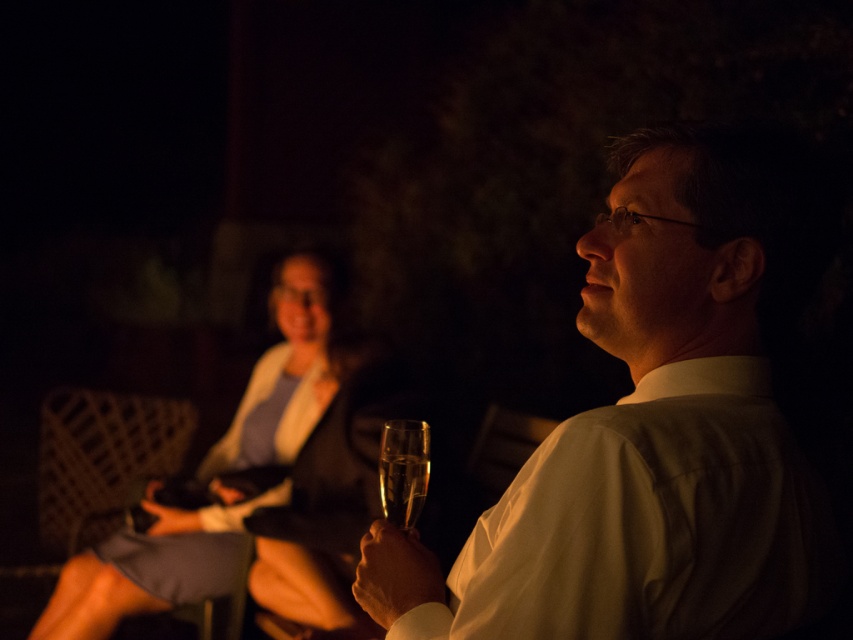
Looking at this image, you are organizing a photo shoot and need to ensure that the matte white shirt at center and the matte black dress at center are both visible in the frame. Based on their sizes, which clothing item might require more careful positioning to avoid being overwhelmed by the other?

The matte white shirt at center occupies less space than the matte black dress at center, so the matte white shirt at center might require more careful positioning to avoid being overwhelmed by the larger matte black dress at center.

Consider the image. You are a photographer adjusting your camera settings to capture the scene. You notice the matte white shirt at center and the matte black dress at center. Which one is closer to the camera?

Result: The matte white shirt at center is positioned over the matte black dress at center, so the matte white shirt at center is closer to the camera.

You are standing in the nighttime scene and want to hand a drink to the person wearing the matte black dress at center. Given that you can reach 7 feet, will you be able to reach them without moving closer?

→ The distance between you and the matte black dress at center is 8.14 feet, which is beyond your 7 feet reach. Therefore, you cannot reach them without moving closer.